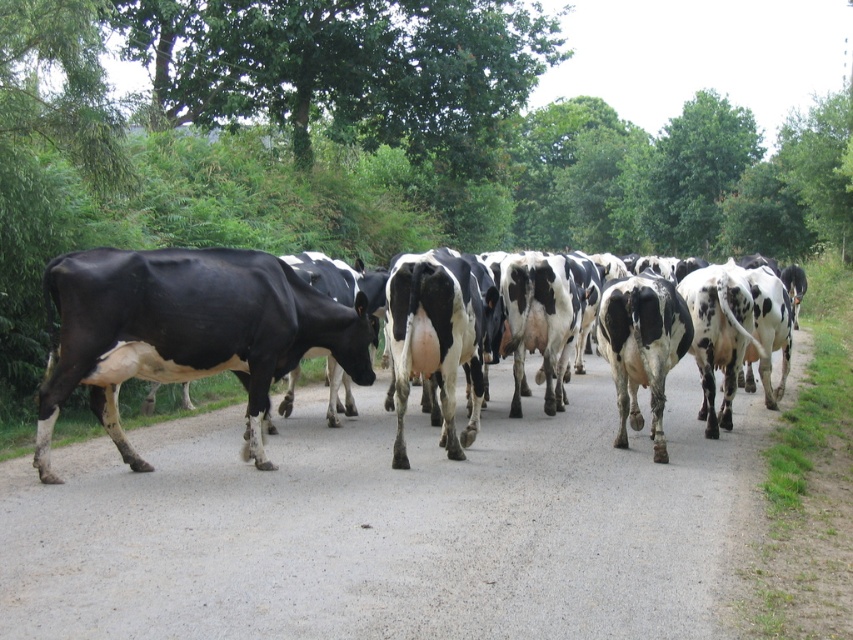
Is point (242, 336) less distant than point (242, 256)?

Yes.

Between black glossy cow at left and black glossy cow at center, which one has less height?

black glossy cow at left is shorter.

Is point (73, 324) positioned behind point (93, 328)?

No, it is in front of (93, 328).

The height and width of the screenshot is (640, 853). Identify the location of black glossy cow at left. (186, 332).